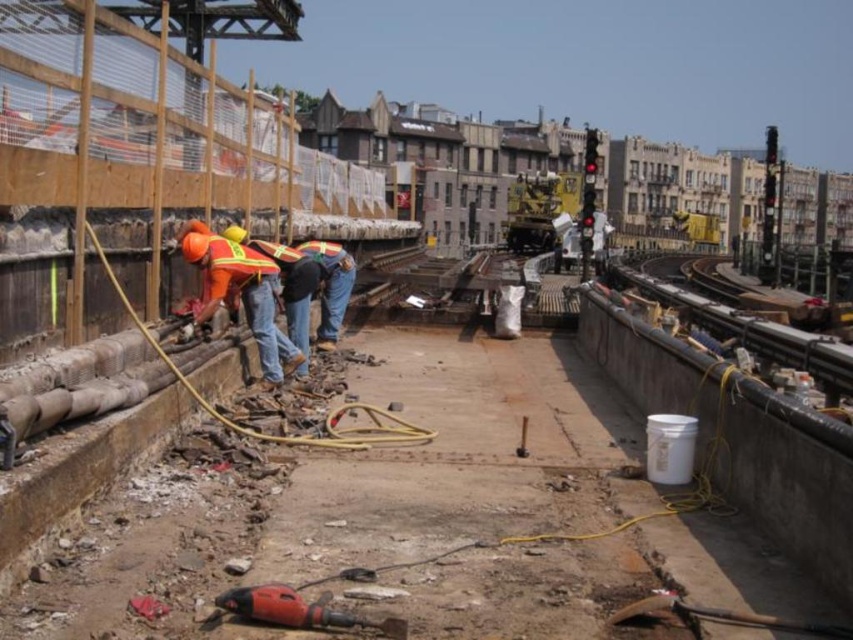
Between red plastic drill at lower center and reflective yellow safety vest at left, which one has less height?

With less height is red plastic drill at lower center.

Can you confirm if red plastic drill at lower center is positioned below reflective yellow safety vest at left?

Yes, red plastic drill at lower center is below reflective yellow safety vest at left.

Between point (285, 595) and point (212, 236), which one is positioned in front?

Point (285, 595) is more forward.

The height and width of the screenshot is (640, 853). Identify the location of red plastic drill at lower center. (299, 611).